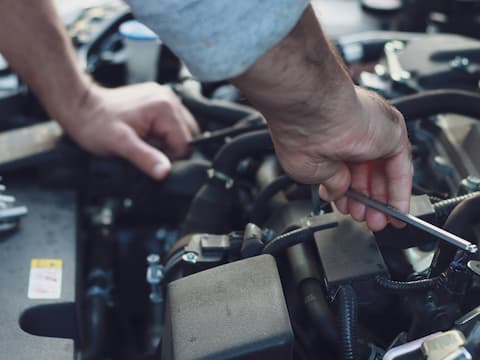
Find the location of `sticker`. sticker is located at coordinates (49, 276).